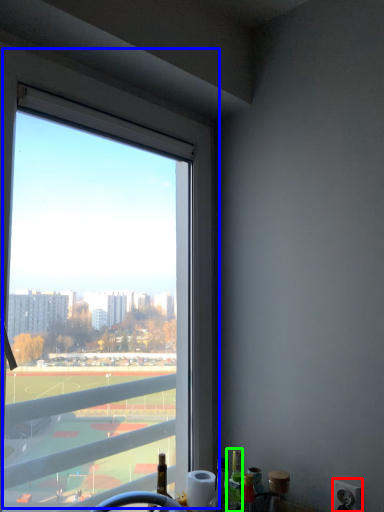
Question: Which object is positioned farthest from power outlet (highlighted by a red box)? Select from window (highlighted by a blue box) and bottle (highlighted by a green box).

Choices:
 (A) window
 (B) bottle

Answer: (A)